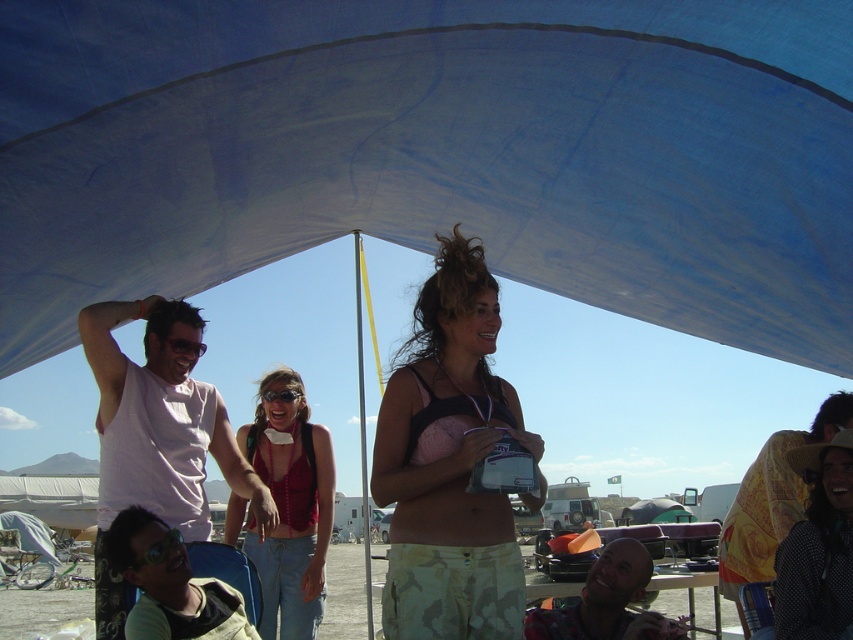
Question: Does blue fabric canopy at upper center have a larger size compared to polka dot fabric hat at lower right?

Choices:
 (A) no
 (B) yes

Answer: (B)

Question: Does camouflage shorts at center have a lesser width compared to black plastic goggles at center?

Choices:
 (A) no
 (B) yes

Answer: (A)

Question: Is denim jeans at center further to the viewer compared to polka dot fabric hat at lower right?

Choices:
 (A) yes
 (B) no

Answer: (A)

Question: Which of the following is the farthest from the observer?

Choices:
 (A) denim jeans at center
 (B) transparent plastic goggles at lower left
 (C) white matte tank top at left

Answer: (A)

Question: Which is farther from the polka dot fabric hat at lower right?

Choices:
 (A) blue fabric canopy at upper center
 (B) white matte tank top at left

Answer: (B)

Question: Estimate the real-world distances between objects in this image. Which object is farther from the transparent plastic goggles at lower left?

Choices:
 (A) camouflage shorts at center
 (B) white matte tank top at left
 (C) plaid shirt at lower right

Answer: (C)